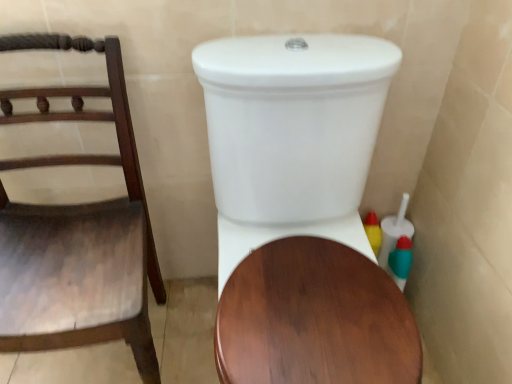
Question: Is wooden chair at left taller than white glossy toilet at center?

Choices:
 (A) yes
 (B) no

Answer: (B)

Question: Is the position of wooden chair at left more distant than that of white glossy toilet at center?

Choices:
 (A) yes
 (B) no

Answer: (A)

Question: Can you confirm if wooden chair at left is thinner than white glossy toilet at center?

Choices:
 (A) yes
 (B) no

Answer: (A)

Question: From a real-world perspective, is wooden chair at left physically below white glossy toilet at center?

Choices:
 (A) no
 (B) yes

Answer: (B)

Question: From the image's perspective, is wooden chair at left located above white glossy toilet at center?

Choices:
 (A) yes
 (B) no

Answer: (A)

Question: From a real-world perspective, does wooden chair at left stand above white glossy toilet at center?

Choices:
 (A) no
 (B) yes

Answer: (A)

Question: Considering the relative sizes of white glossy toilet at center and wooden chair at left in the image provided, is white glossy toilet at center bigger than wooden chair at left?

Choices:
 (A) yes
 (B) no

Answer: (A)

Question: Are white glossy toilet at center and wooden chair at left beside each other?

Choices:
 (A) no
 (B) yes

Answer: (A)

Question: Does white glossy toilet at center come behind wooden chair at left?

Choices:
 (A) yes
 (B) no

Answer: (B)

Question: From a real-world perspective, is white glossy toilet at center beneath wooden chair at left?

Choices:
 (A) no
 (B) yes

Answer: (A)

Question: Is white glossy toilet at center oriented towards wooden chair at left?

Choices:
 (A) yes
 (B) no

Answer: (B)

Question: Can wooden chair at left be found inside white glossy toilet at center?

Choices:
 (A) yes
 (B) no

Answer: (B)

Question: Based on their positions, is wooden chair at left located to the left or right of white glossy toilet at center?

Choices:
 (A) right
 (B) left

Answer: (B)